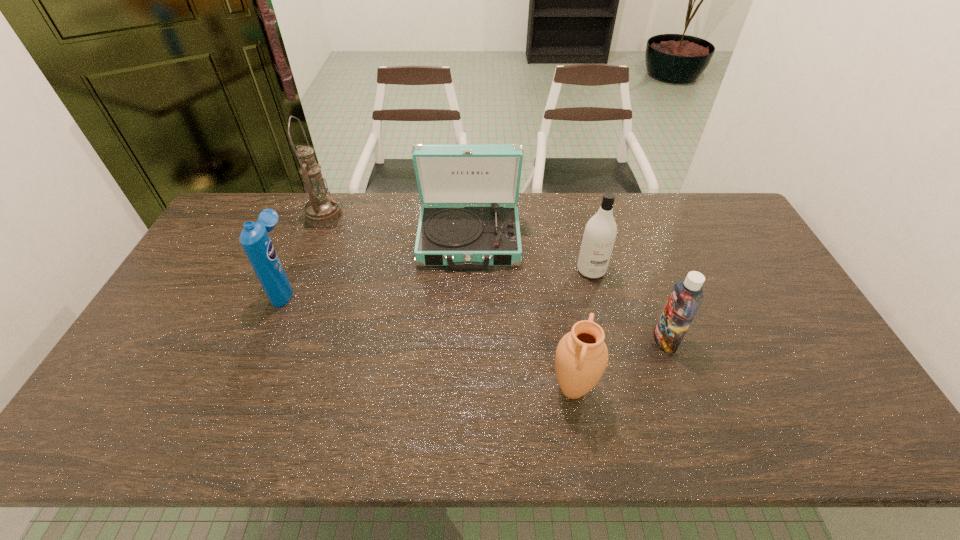
The width and height of the screenshot is (960, 540). In order to click on oil lamp in this screenshot , I will do `click(321, 211)`.

Where is `record player`? Image resolution: width=960 pixels, height=540 pixels. record player is located at coordinates (462, 237).

You are a GUI agent. You are given a task and a screenshot of the screen. Output one action in this format:
    pyautogui.click(x=<x>, y=<y>)
    Task: Click on the second object from right to left
    This screenshot has width=960, height=540.
    Given the screenshot: What is the action you would take?
    pyautogui.click(x=600, y=232)

You are a GUI agent. You are given a task and a screenshot of the screen. Output one action in this format:
    pyautogui.click(x=<x>, y=<y>)
    Task: Click on the leftmost shampoo
    The width and height of the screenshot is (960, 540).
    Given the screenshot: What is the action you would take?
    pyautogui.click(x=254, y=238)

This screenshot has height=540, width=960. Find the location of `the rightmost shampoo`. the rightmost shampoo is located at coordinates (686, 297).

Where is `the rightmost object`? Image resolution: width=960 pixels, height=540 pixels. the rightmost object is located at coordinates (686, 297).

Where is `urn`? urn is located at coordinates [x=581, y=358].

Locate an element on the screen. Image resolution: width=960 pixels, height=540 pixels. the nearest object is located at coordinates (581, 358).

You are a GUI agent. You are given a task and a screenshot of the screen. Output one action in this format:
    pyautogui.click(x=<x>, y=<y>)
    Task: Click on the vacant space positioned 0.320m on the front of the oil lamp
    
    Given the screenshot: What is the action you would take?
    pyautogui.click(x=292, y=297)

I want to click on free space located 0.390m on the face side of the fourth object from right to left, so click(466, 384).